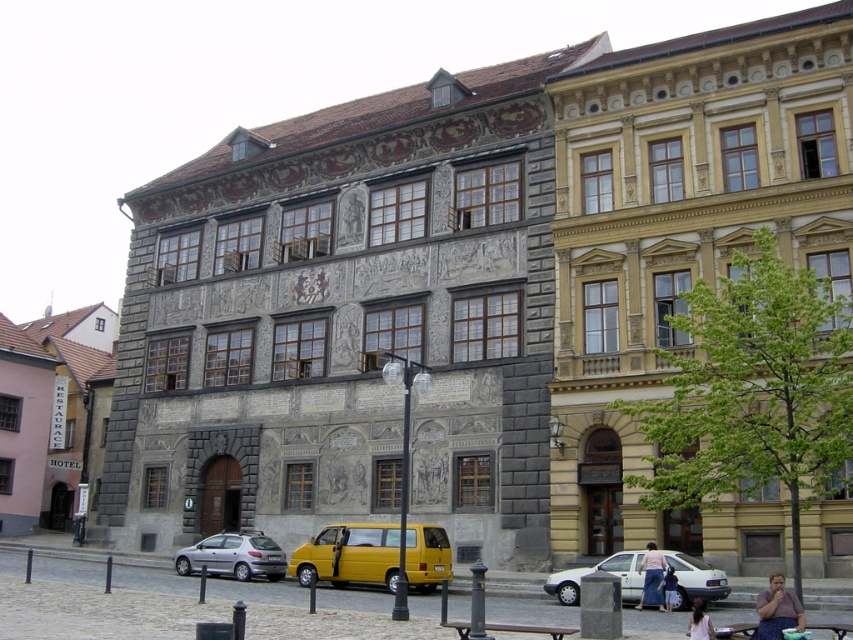
Can you confirm if denim skirt at lower right is smaller than light brown leather jacket at lower center?

No, denim skirt at lower right is not smaller than light brown leather jacket at lower center.

Can you confirm if denim skirt at lower right is thinner than light brown leather jacket at lower center?

Incorrect, denim skirt at lower right's width is not less than light brown leather jacket at lower center's.

Which is in front, point (643, 566) or point (672, 593)?

Positioned in front is point (672, 593).

Locate an element on the screen. denim skirt at lower right is located at coordinates click(653, 577).

Between point (248, 554) and point (660, 566), which one is positioned behind?

The point (248, 554) is more distant.

Locate an element on the screen. silver metallic hatchback at lower left is located at coordinates (233, 556).

Does white matte sedan at lower center appear on the left side of light brown leather jacket at lower center?

Yes, white matte sedan at lower center is to the left of light brown leather jacket at lower center.

Is white matte sedan at lower center to the right of light brown leather jacket at lower center from the viewer's perspective?

In fact, white matte sedan at lower center is to the left of light brown leather jacket at lower center.

You are a GUI agent. You are given a task and a screenshot of the screen. Output one action in this format:
    pyautogui.click(x=<x>, y=<y>)
    Task: Click on the white matte sedan at lower center
    This screenshot has height=640, width=853.
    Given the screenshot: What is the action you would take?
    pyautogui.click(x=595, y=570)